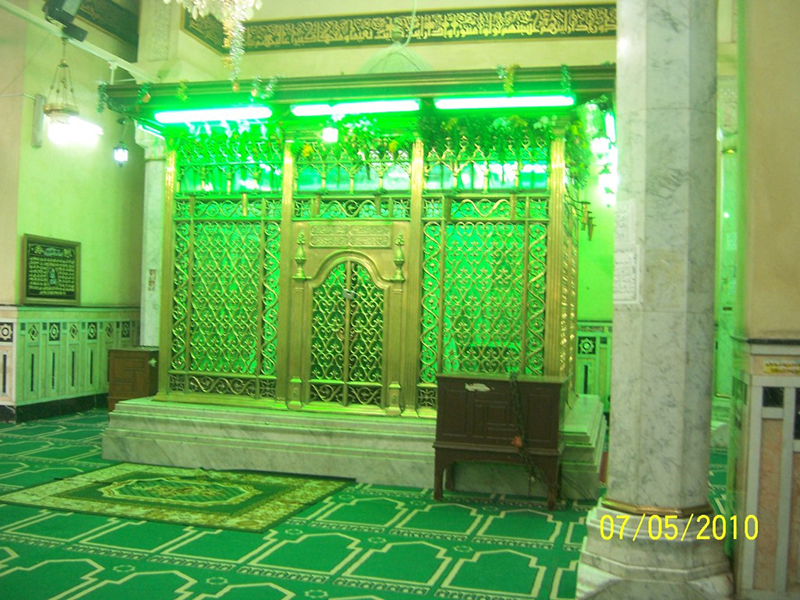
This screenshot has width=800, height=600. Identify the location of hanging lights. (121, 150), (73, 131), (614, 164).